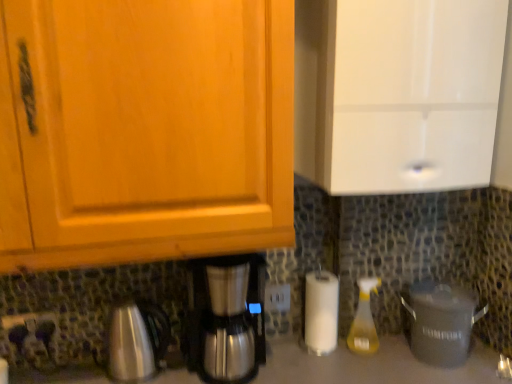
Question: Can you see white plastic power plugs and sockets at center, which ranks as the 2th power plugs and sockets in front-to-back order, touching gray matte crock pot at lower right?

Choices:
 (A) no
 (B) yes

Answer: (A)

Question: Is white plastic power plugs and sockets at center, positioned as the second power plugs and sockets in left-to-right order, oriented towards gray matte crock pot at lower right?

Choices:
 (A) yes
 (B) no

Answer: (B)

Question: Is white plastic power plugs and sockets at center, acting as the 1th power plugs and sockets starting from the right, positioned in front of gray matte crock pot at lower right?

Choices:
 (A) no
 (B) yes

Answer: (A)

Question: Does white plastic power plugs and sockets at center, positioned as the second power plugs and sockets in left-to-right order, have a greater width compared to gray matte crock pot at lower right?

Choices:
 (A) yes
 (B) no

Answer: (B)

Question: Is white plastic power plugs and sockets at center, acting as the 1th power plugs and sockets starting from the right, looking in the opposite direction of gray matte crock pot at lower right?

Choices:
 (A) yes
 (B) no

Answer: (B)

Question: Considering the positions of gray matte crock pot at lower right and matte black outlet at lower center in the image, is gray matte crock pot at lower right wider or thinner than matte black outlet at lower center?

Choices:
 (A) thin
 (B) wide

Answer: (B)

Question: Does point (415, 344) appear closer or farther from the camera than point (49, 321)?

Choices:
 (A) farther
 (B) closer

Answer: (A)

Question: Visually, is gray matte crock pot at lower right positioned to the left or to the right of matte black outlet at lower center?

Choices:
 (A) right
 (B) left

Answer: (A)

Question: Is gray matte crock pot at lower right in front of or behind matte black outlet at lower center in the image?

Choices:
 (A) front
 (B) behind

Answer: (A)

Question: Relative to gray matte crock pot at lower right, is white glossy cabinet at upper right in front or behind?

Choices:
 (A) behind
 (B) front

Answer: (B)

Question: Is white glossy cabinet at upper right taller or shorter than gray matte crock pot at lower right?

Choices:
 (A) tall
 (B) short

Answer: (A)

Question: Considering the positions of white glossy cabinet at upper right and gray matte crock pot at lower right in the image, is white glossy cabinet at upper right bigger or smaller than gray matte crock pot at lower right?

Choices:
 (A) big
 (B) small

Answer: (A)

Question: In terms of width, does white glossy cabinet at upper right look wider or thinner when compared to gray matte crock pot at lower right?

Choices:
 (A) wide
 (B) thin

Answer: (A)

Question: From the image's perspective, is yellow translucent spray bottle at lower right above or below gray matte crock pot at lower right?

Choices:
 (A) above
 (B) below

Answer: (A)

Question: Relative to gray matte crock pot at lower right, is yellow translucent spray bottle at lower right in front or behind?

Choices:
 (A) front
 (B) behind

Answer: (B)